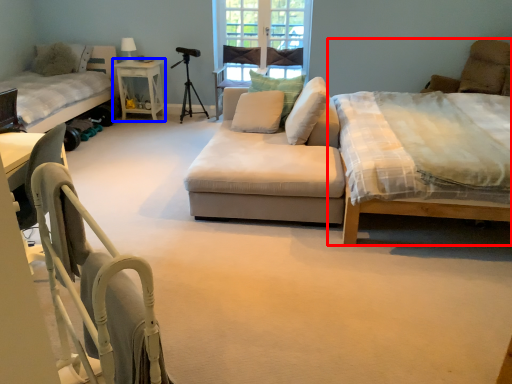
Question: Which object appears farthest to the camera in this image, bed (highlighted by a red box) or table (highlighted by a blue box)?

Choices:
 (A) bed
 (B) table

Answer: (B)